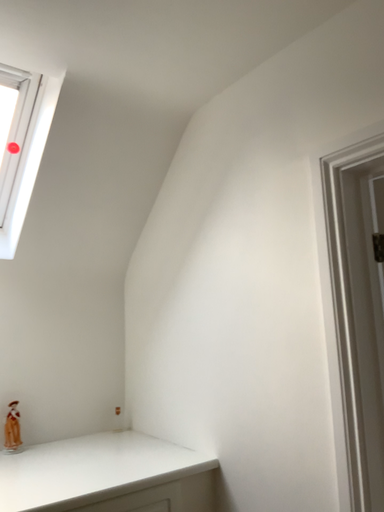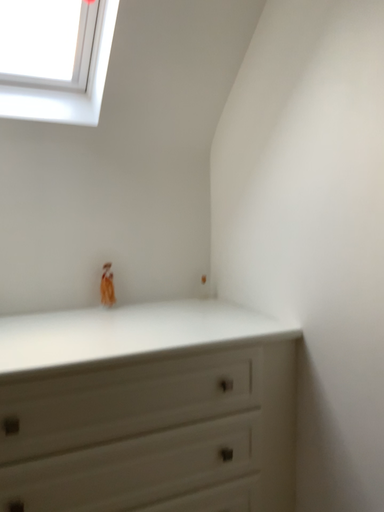
Question: How did the camera likely rotate when shooting the video?

Choices:
 (A) rotated upward
 (B) rotated downward

Answer: (B)